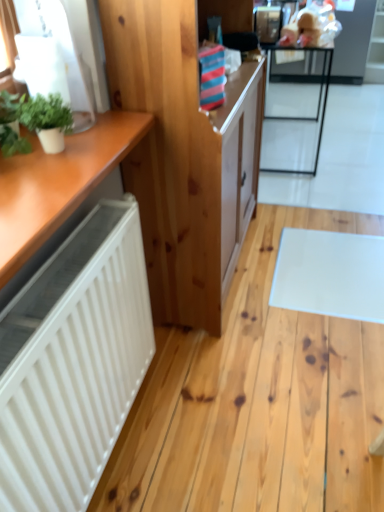
Where is `free spot to the right of metallic black table at upper right`? free spot to the right of metallic black table at upper right is located at coordinates (360, 137).